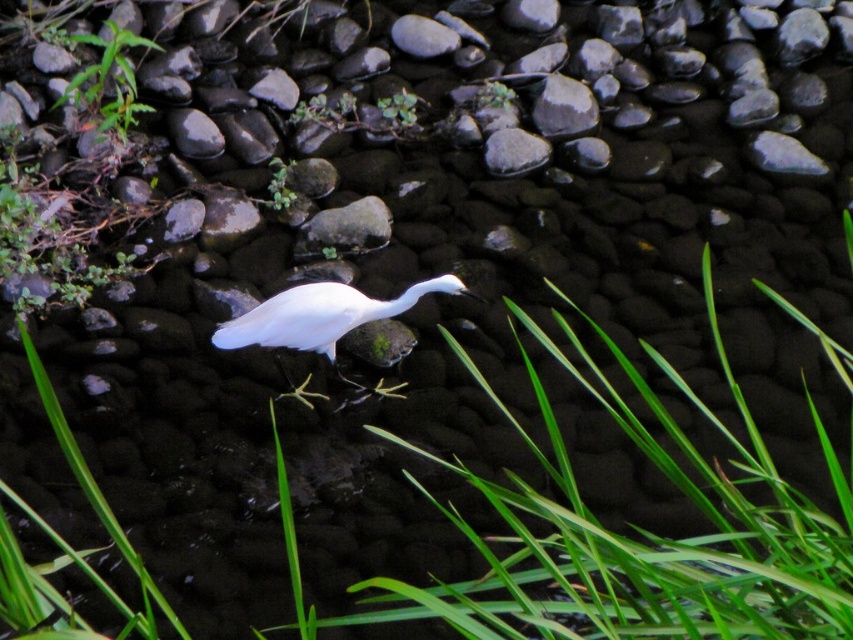
Is green leafy grass at center closer to camera compared to green leafy plant at upper left?

Yes, it is.

Which is below, green leafy grass at center or green leafy plant at upper left?

green leafy grass at center

Locate an element on the screen. This screenshot has height=640, width=853. green leafy grass at center is located at coordinates (624, 536).

What are the coordinates of `green leafy grass at center` in the screenshot? It's located at pos(624,536).

Where is `white matte bird at center`? The image size is (853, 640). white matte bird at center is located at coordinates (321, 316).

Can you confirm if white matte bird at center is smaller than green leafy plant at upper left?

Indeed, white matte bird at center has a smaller size compared to green leafy plant at upper left.

The width and height of the screenshot is (853, 640). What do you see at coordinates (321, 316) in the screenshot? I see `white matte bird at center` at bounding box center [321, 316].

This screenshot has width=853, height=640. I want to click on white matte bird at center, so click(321, 316).

Does white matte bird at center have a smaller size compared to smooth gray rock at center?

Actually, white matte bird at center might be larger than smooth gray rock at center.

How much distance is there between white matte bird at center and smooth gray rock at center?

34.57 inches

Is point (335, 282) positioned before point (347, 220)?

Yes, point (335, 282) is closer to viewer.

This screenshot has height=640, width=853. I want to click on white matte bird at center, so click(x=321, y=316).